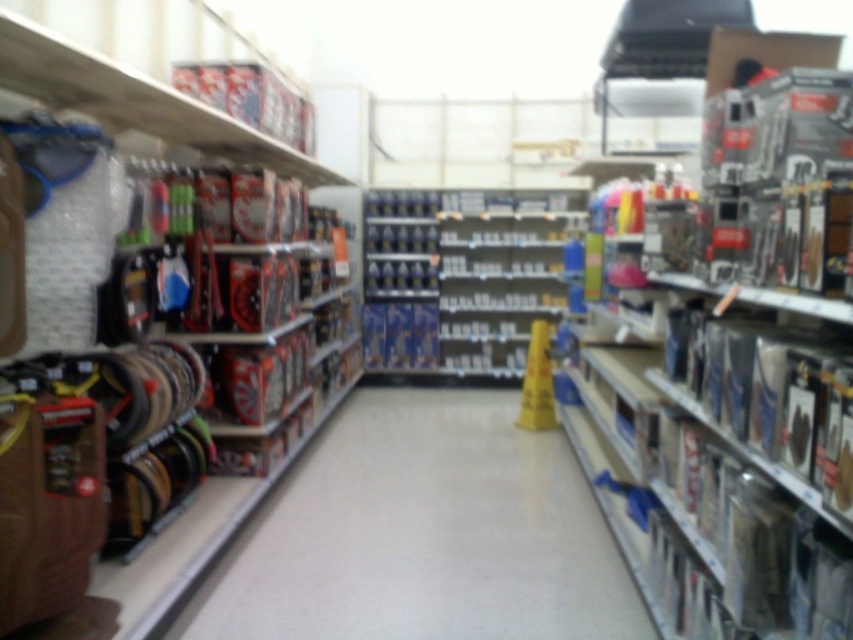
You are a customer in the store and want to walk from the entrance to the checkout counter located at the back of the store. The path leads you through the smooth plastic aisle at center and past the metallic silver tools at left. Which object will you encounter first as you walk towards the checkout?

The smooth plastic aisle at center is shorter than metallic silver tools at left, so you will encounter the smooth plastic aisle at center first because it is closer to your starting position.

You are a delivery person who needs to navigate through the retail store aisle. The store has a section with automotive supplies. There are shelves on both sides of the aisle. You must avoid the shelves to prevent damaging any products. Can you safely walk through the center of the aisle marked by point (422, 534)?

Yes, you can safely walk through the center of the aisle marked by point (422, 534) because the Objects Description states that this point marks a smooth plastic aisle at center, which is likely clear of obstacles and suitable for passage.

Based on the photo, you are a customer looking for the metallic silver tools at left and the smooth plastic aisle at center. According to the store layout, which one is located to the right of the other?

The smooth plastic aisle at center is positioned on the right side of metallic silver tools at left, so the smooth plastic aisle at center is to the right of the metallic silver tools at left.